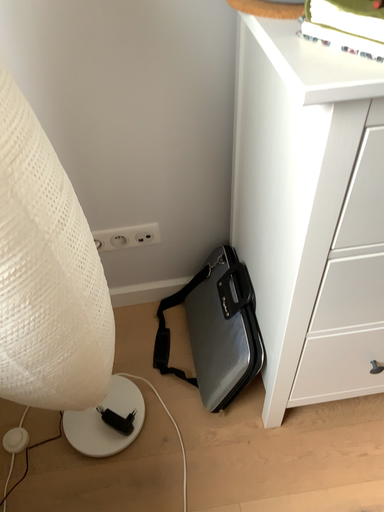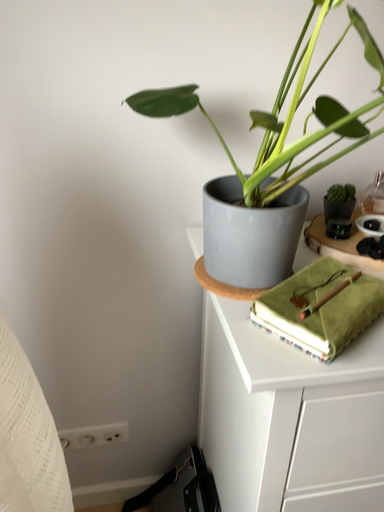
Question: Which way did the camera rotate in the video?

Choices:
 (A) rotated downward
 (B) rotated upward

Answer: (B)